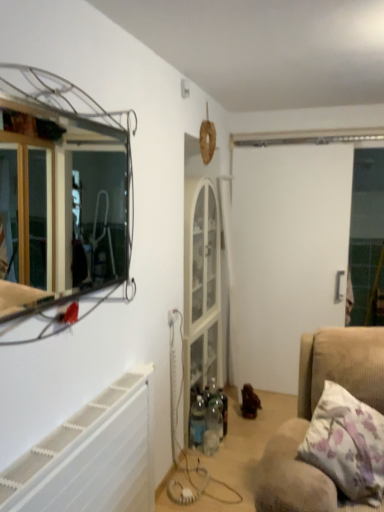
The height and width of the screenshot is (512, 384). Find the location of `white matte screen door at center`. white matte screen door at center is located at coordinates (286, 255).

Measure the distance between point [266,215] and camera.

Point [266,215] and camera are 11.45 feet apart from each other.

The width and height of the screenshot is (384, 512). Describe the element at coordinates (347, 444) in the screenshot. I see `floral fabric pillow at lower right` at that location.

What are the coordinates of `metallic wire frame mirror at upper left` in the screenshot? It's located at (68, 209).

What do you see at coordinates (68, 209) in the screenshot? The width and height of the screenshot is (384, 512). I see `metallic wire frame mirror at upper left` at bounding box center [68, 209].

At what (x,y) coordinates should I click in order to perform the action: click on white matte screen door at center. Please return your answer as a coordinate pair (x, y). The image size is (384, 512). Looking at the image, I should click on (286, 255).

Which is behind, point (254, 415) or point (69, 474)?

The point (254, 415) is behind.

From a real-world perspective, which is physically below, brown wooden toy at center or white plastic radiator at lower left?

brown wooden toy at center.

What's the angular difference between brown wooden toy at center and white plastic radiator at lower left's facing directions?

10.6 degrees.

Does brown wooden toy at center have a lesser height compared to white plastic radiator at lower left?

Yes, brown wooden toy at center is shorter than white plastic radiator at lower left.

Considering the points (267, 196) and (128, 222), which point is behind, point (267, 196) or point (128, 222)?

Positioned behind is point (267, 196).

Which object is positioned more to the right, white matte screen door at center or metallic wire frame mirror at upper left?

white matte screen door at center.

Looking at this image, between white matte screen door at center and metallic wire frame mirror at upper left, which one has smaller size?

metallic wire frame mirror at upper left.

From a real-world perspective, which is physically above, white matte screen door at center or metallic wire frame mirror at upper left?

In real-world perspective, metallic wire frame mirror at upper left is above.

Is point (20, 232) positioned before point (255, 413)?

That is False.

How many degrees apart are the facing directions of metallic wire frame mirror at upper left and brown wooden toy at center?

The facing directions of metallic wire frame mirror at upper left and brown wooden toy at center are 10 degrees apart.

Are metallic wire frame mirror at upper left and brown wooden toy at center located far from each other?

Yes.

Does metallic wire frame mirror at upper left turn towards brown wooden toy at center?

No, metallic wire frame mirror at upper left is not turned towards brown wooden toy at center.

How many degrees apart are the facing directions of white plastic radiator at lower left and white matte screen door at center?

89.5 degrees.

Where is `screen door behind the white plastic radiator at lower left`? screen door behind the white plastic radiator at lower left is located at coordinates (286, 255).

From the image's perspective, is white plastic radiator at lower left over white matte screen door at center?

No, from the image's perspective, white plastic radiator at lower left is not over white matte screen door at center.

Is white plastic radiator at lower left in front of brown wooden toy at center?

Yes.

How different are the orientations of white plastic radiator at lower left and brown wooden toy at center in degrees?

The angular difference between white plastic radiator at lower left and brown wooden toy at center is 10.6 degrees.

Locate an element on the screen. toy below the white plastic radiator at lower left (from a real-world perspective) is located at coordinates click(x=249, y=402).

Is white plastic radiator at lower left in contact with brown wooden toy at center?

No, white plastic radiator at lower left is not with brown wooden toy at center.

Considering the positions of points (146, 391) and (90, 227), is point (146, 391) closer to camera compared to point (90, 227)?

Yes, it is in front of point (90, 227).

In the scene shown: From a real-world perspective, is white plastic radiator at lower left under metallic wire frame mirror at upper left?

Yes, from a real-world perspective, white plastic radiator at lower left is below metallic wire frame mirror at upper left.

Which object is further away from the camera, white plastic radiator at lower left or metallic wire frame mirror at upper left?

white plastic radiator at lower left is further away from the camera.

Considering the relative sizes of white plastic radiator at lower left and metallic wire frame mirror at upper left in the image provided, is white plastic radiator at lower left smaller than metallic wire frame mirror at upper left?

Incorrect, white plastic radiator at lower left is not smaller in size than metallic wire frame mirror at upper left.

From the picture: From a real-world perspective, between floral fabric pillow at lower right and white matte screen door at center, who is vertically higher?

white matte screen door at center, from a real-world perspective.

Considering the sizes of objects floral fabric pillow at lower right and white matte screen door at center in the image provided, who is thinner, floral fabric pillow at lower right or white matte screen door at center?

With smaller width is white matte screen door at center.

Is point (328, 438) farther from viewer compared to point (308, 211)?

No.

I want to click on radiator on the left of the brown wooden toy at center, so click(91, 456).

Where is `screen door behind the metallic wire frame mirror at upper left`? This screenshot has width=384, height=512. screen door behind the metallic wire frame mirror at upper left is located at coordinates (286, 255).

Estimate the real-world distances between objects in this image. Which object is closer to white matte screen door at center, floral fabric pillow at lower right or white plastic radiator at lower left?

Among the two, floral fabric pillow at lower right is located nearer to white matte screen door at center.

From the image, which object appears to be nearer to white plastic radiator at lower left, floral fabric pillow at lower right or white matte screen door at center?

floral fabric pillow at lower right.

Which object lies further to the anchor point white matte screen door at center, metallic wire frame mirror at upper left or white plastic radiator at lower left?

Among the two, white plastic radiator at lower left is located further to white matte screen door at center.

When comparing their distances from floral fabric pillow at lower right, does brown wooden toy at center or white matte screen door at center seem closer?

brown wooden toy at center.

Based on their spatial positions, is white matte screen door at center or brown wooden toy at center closer to white plastic radiator at lower left?

brown wooden toy at center is positioned closer to the anchor white plastic radiator at lower left.

Considering their positions, is white matte screen door at center positioned further to floral fabric pillow at lower right than metallic wire frame mirror at upper left?

metallic wire frame mirror at upper left.

From the image, which object appears to be farther from white matte screen door at center, brown wooden toy at center or white plastic radiator at lower left?

The object further to white matte screen door at center is white plastic radiator at lower left.

When comparing their distances from metallic wire frame mirror at upper left, does white matte screen door at center or brown wooden toy at center seem closer?

Based on the image, white matte screen door at center appears to be nearer to metallic wire frame mirror at upper left.

In order to click on radiator located between metallic wire frame mirror at upper left and white matte screen door at center in the depth direction in this screenshot , I will do `click(91, 456)`.

You are a GUI agent. You are given a task and a screenshot of the screen. Output one action in this format:
    pyautogui.click(x=<x>, y=<y>)
    Task: Click on the radiator between metallic wire frame mirror at upper left and brown wooden toy at center along the z-axis
    
    Given the screenshot: What is the action you would take?
    click(x=91, y=456)

The height and width of the screenshot is (512, 384). Identify the location of pillow between metallic wire frame mirror at upper left and white plastic radiator at lower left in the vertical direction. (347, 444).

Where is `toy between metallic wire frame mirror at upper left and white matte screen door at center from front to back`? toy between metallic wire frame mirror at upper left and white matte screen door at center from front to back is located at coordinates (249, 402).